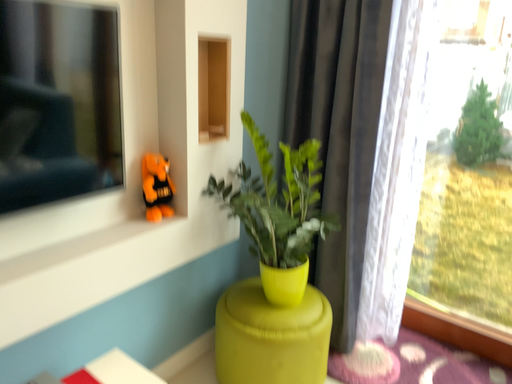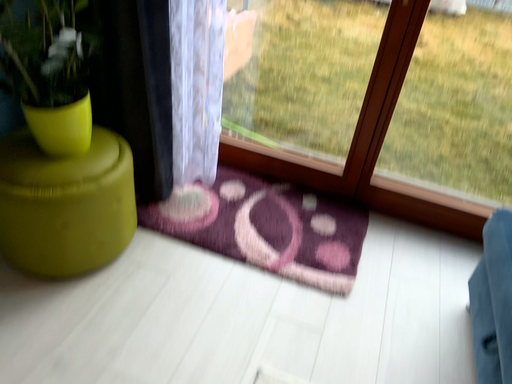
Question: Which way did the camera rotate in the video?

Choices:
 (A) rotated right
 (B) rotated left

Answer: (A)